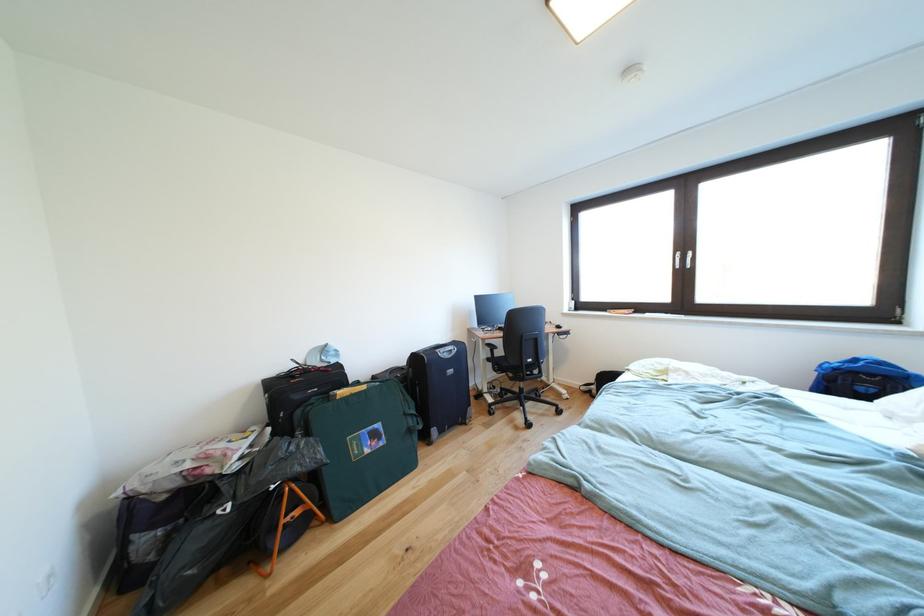
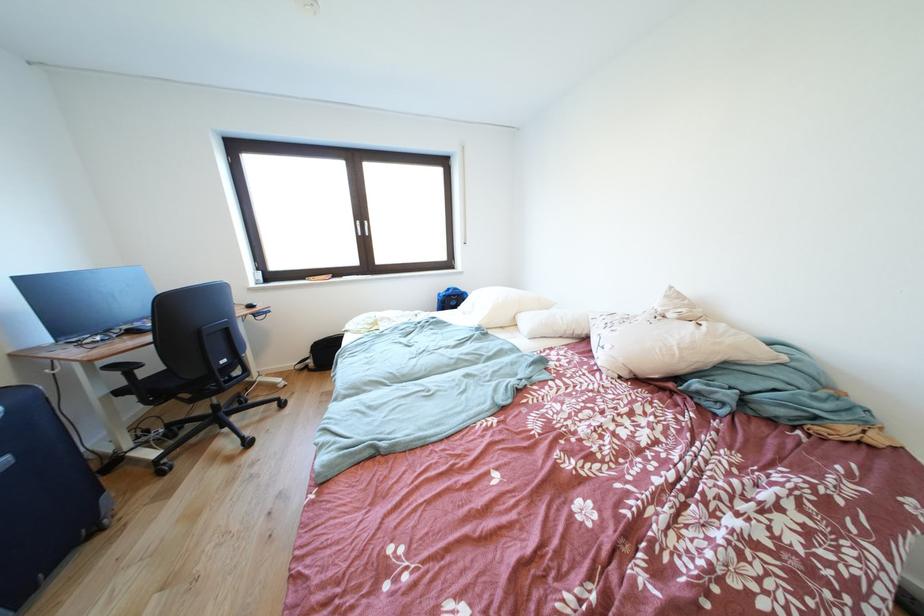
Where in the second image is the point corresponding to point 687,259 from the first image?

(367, 228)